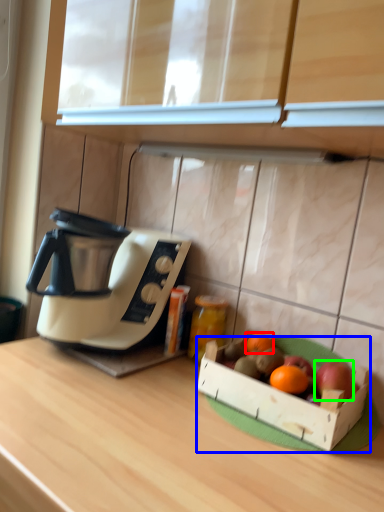
Question: Based on their relative distances, which object is farther from grapefruit (highlighted by a red box)? Choose from cardboard box (highlighted by a blue box) and apple (highlighted by a green box).

Choices:
 (A) cardboard box
 (B) apple

Answer: (B)